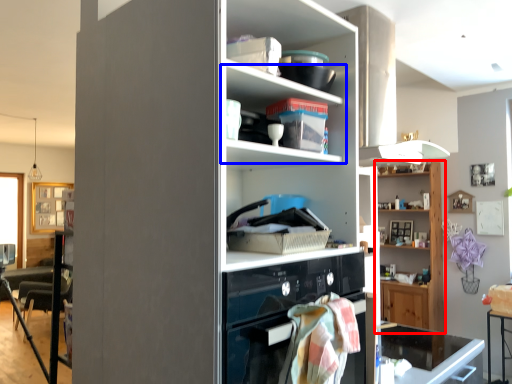
Question: Which object is closer to the camera taking this photo, shelf (highlighted by a red box) or shelf (highlighted by a blue box)?

Choices:
 (A) shelf
 (B) shelf

Answer: (B)